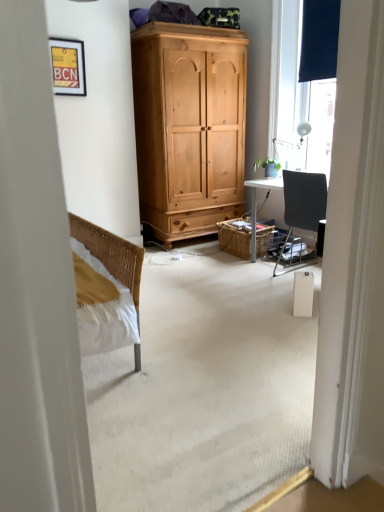
Question: Would you say green matte plant at right is part of dark matte curtain at upper right's contents?

Choices:
 (A) yes
 (B) no

Answer: (B)

Question: Are dark matte curtain at upper right and green matte plant at right far apart?

Choices:
 (A) no
 (B) yes

Answer: (B)

Question: Is dark matte curtain at upper right outside green matte plant at right?

Choices:
 (A) yes
 (B) no

Answer: (A)

Question: From a real-world perspective, does dark matte curtain at upper right stand above green matte plant at right?

Choices:
 (A) yes
 (B) no

Answer: (A)

Question: From a real-world perspective, does dark matte curtain at upper right sit lower than green matte plant at right?

Choices:
 (A) yes
 (B) no

Answer: (B)

Question: Can you confirm if dark matte curtain at upper right is bigger than green matte plant at right?

Choices:
 (A) no
 (B) yes

Answer: (B)

Question: Is matte black window at upper right shorter than dark matte curtain at upper right?

Choices:
 (A) yes
 (B) no

Answer: (B)

Question: Considering the relative positions of matte black window at upper right and dark matte curtain at upper right in the image provided, is matte black window at upper right to the right of dark matte curtain at upper right from the viewer's perspective?

Choices:
 (A) no
 (B) yes

Answer: (B)

Question: Does matte black window at upper right lie behind dark matte curtain at upper right?

Choices:
 (A) no
 (B) yes

Answer: (A)

Question: Is matte black window at upper right outside of dark matte curtain at upper right?

Choices:
 (A) yes
 (B) no

Answer: (A)

Question: Considering the relative sizes of matte black window at upper right and dark matte curtain at upper right in the image provided, is matte black window at upper right bigger than dark matte curtain at upper right?

Choices:
 (A) yes
 (B) no

Answer: (A)

Question: Can you confirm if matte black window at upper right is wider than dark matte curtain at upper right?

Choices:
 (A) yes
 (B) no

Answer: (A)

Question: Is green matte plant at right beside matte yellow picture frame at upper left?

Choices:
 (A) yes
 (B) no

Answer: (B)